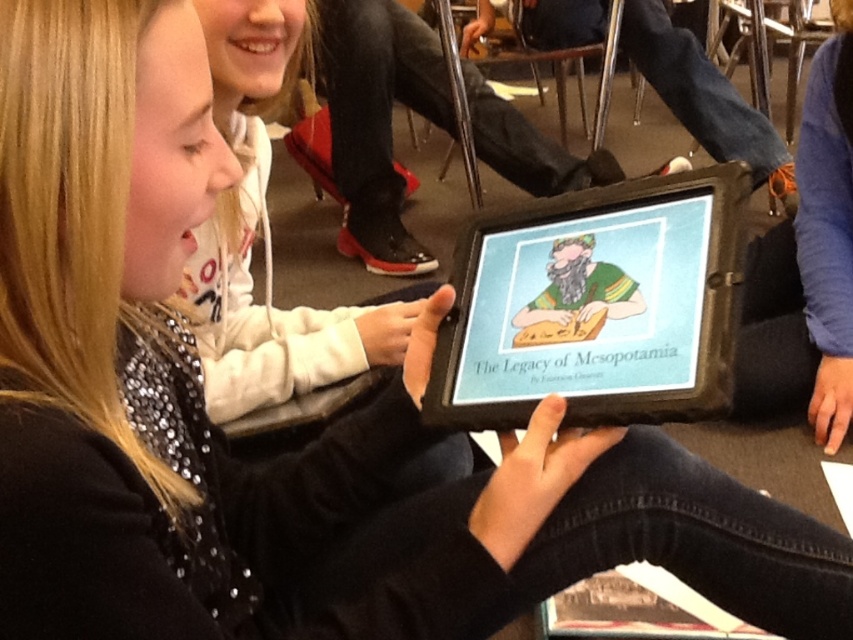
You are a student in the classroom and notice two tablets displayed in the scene. Which tablet is positioned lower? The black matte tablet at center or the matte black tablet at center?

The black matte tablet at center is positioned lower than the matte black tablet at center.

What are the coordinates of the black matte tablet at center?

The black matte tablet at center is located at point [596,307].

You are a student in the classroom and want to hand your assignment to the teacher. The teacher is standing at the front of the room, near the blackboard. You have to walk from your seat to the teacher. There are two tablets on the desk between you and the teacher. One is the black matte tablet at center and the other is the matte black tablet at center. Which tablet should you go around to reach the teacher faster?

The two tablets are 15.60 inches apart from each other. Since they are both on the desk between you and the teacher, you can choose either side to go around. However, since they are positioned at the center, going around either the black matte tablet at center or the matte black tablet at center would require the same distance to reach the teacher.